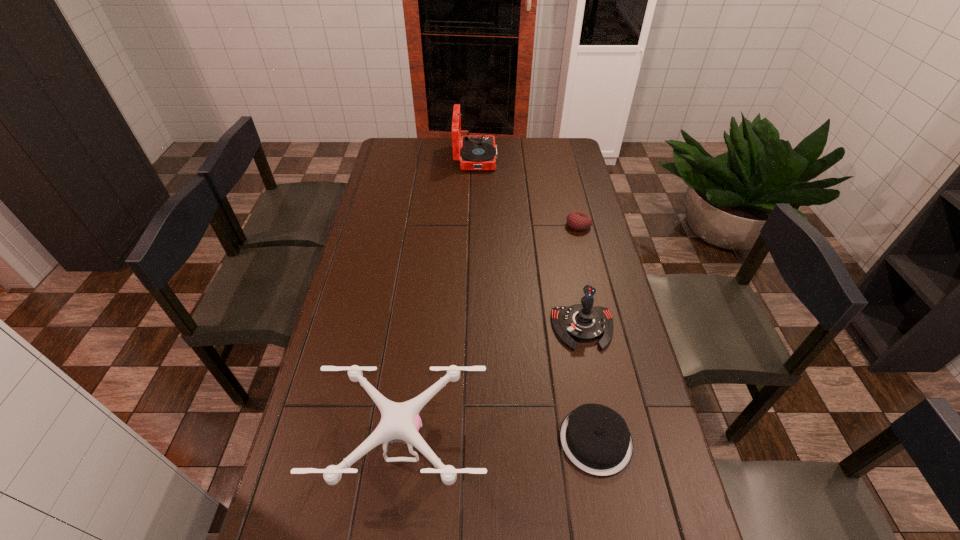
Identify the location of free space located 0.100m on the front of the pancake. click(611, 523).

You are a GUI agent. You are given a task and a screenshot of the screen. Output one action in this format:
    pyautogui.click(x=<x>, y=<y>)
    Task: Click on the object that is at the far edge
    
    Given the screenshot: What is the action you would take?
    pyautogui.click(x=478, y=152)

Identify the location of object positioned at the left edge. The image size is (960, 540). (400, 422).

In order to click on joystick situated at the right edge in this screenshot , I will do `click(581, 322)`.

Identify the location of beanbag positioned at the right edge. This screenshot has height=540, width=960. (578, 221).

At what (x,y) coordinates should I click in order to perform the action: click on pancake that is at the right edge. Please return your answer as a coordinate pair (x, y). The width and height of the screenshot is (960, 540). Looking at the image, I should click on (596, 439).

At what (x,y) coordinates should I click in order to perform the action: click on vacant point at the left edge. Please return your answer as a coordinate pair (x, y). The height and width of the screenshot is (540, 960). Looking at the image, I should click on (385, 247).

The width and height of the screenshot is (960, 540). Find the location of `free space at the right edge of the desktop`. free space at the right edge of the desktop is located at coordinates (636, 424).

In the image, there is a desktop. Where is `vacant space at the far right corner`? Image resolution: width=960 pixels, height=540 pixels. vacant space at the far right corner is located at coordinates (564, 163).

Where is `free space between the joystick and the drone`? free space between the joystick and the drone is located at coordinates (493, 385).